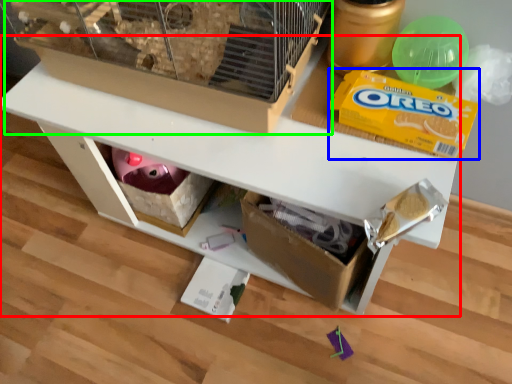
Question: Estimate the real-world distances between objects in this image. Which object is farther from table (highlighted by a red box), cereal (highlighted by a blue box) or bird cage (highlighted by a green box)?

Choices:
 (A) cereal
 (B) bird cage

Answer: (A)